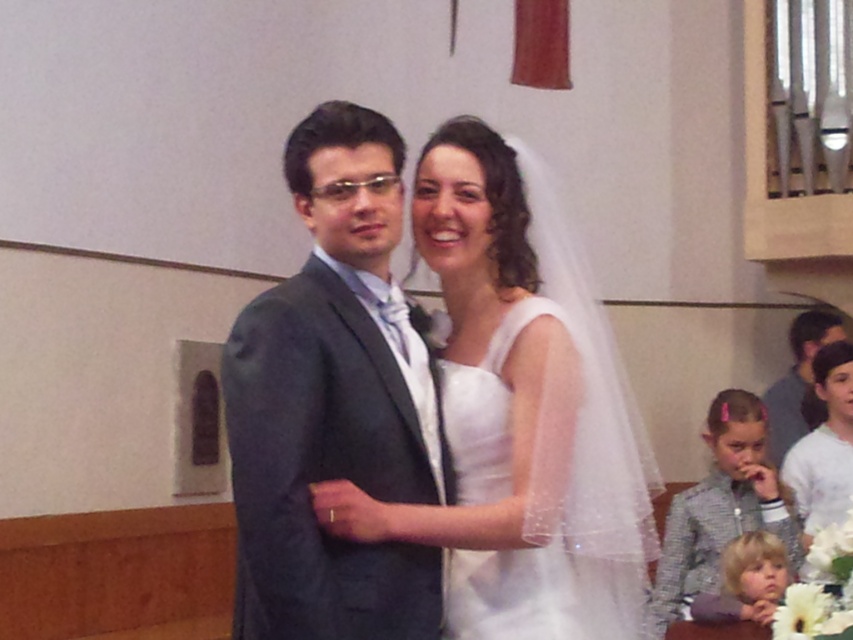
You are a photographer at the wedding and want to capture a clear shot of both the white sheer fabric dress at center and the white cotton shirt at center. Which one is closer to the camera?

The white sheer fabric dress at center is in front of the white cotton shirt at center, so it is closer to the camera.

You are a photographer at a wedding. You need to capture a closeup of the white sheer fabric dress at center. The camera is currently positioned at point (553, 496). Is the camera positioned correctly to capture the dress?

The white sheer fabric dress at center is located at point (553, 496), so the camera is positioned correctly to capture the dress.